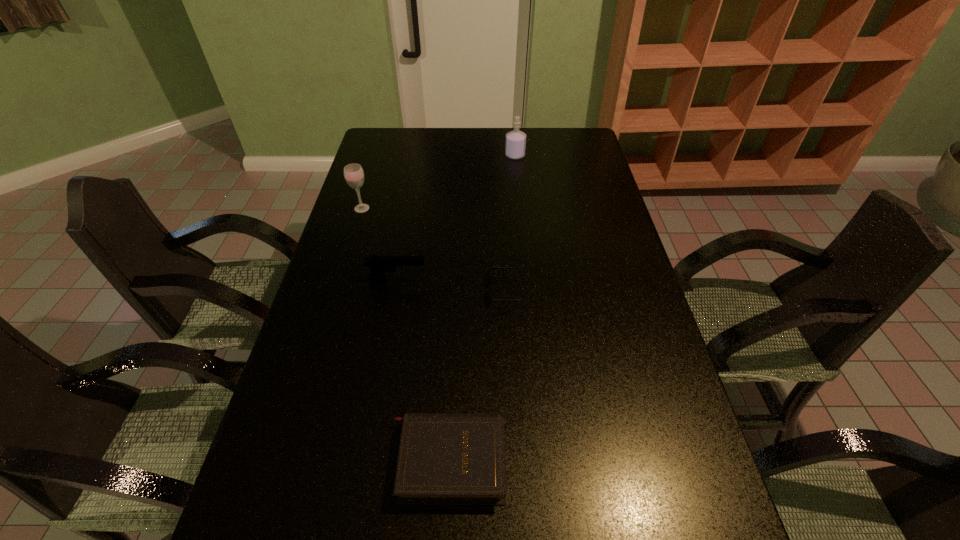
Find the location of a particular element. The height and width of the screenshot is (540, 960). free space located 0.120m on the front-facing side of the sunglasses is located at coordinates (448, 290).

Locate an element on the screen. This screenshot has width=960, height=540. free region located 0.330m on the front-facing side of the sunglasses is located at coordinates (373, 290).

Locate an element on the screen. This screenshot has width=960, height=540. free spot located 0.150m on the front-facing side of the sunglasses is located at coordinates (438, 290).

Find the location of a particular element. The width and height of the screenshot is (960, 540). object at the far edge is located at coordinates (515, 145).

This screenshot has width=960, height=540. I want to click on wineglass located in the left edge section of the desktop, so click(x=353, y=173).

Find the location of `pistol situated at the left edge`. pistol situated at the left edge is located at coordinates (379, 264).

This screenshot has height=540, width=960. In the image, there is a desktop. Identify the location of blank space at the left edge. (373, 292).

The width and height of the screenshot is (960, 540). Identify the location of vacant space at the right edge of the desktop. (628, 305).

Locate an element on the screen. The image size is (960, 540). blank space at the far left corner is located at coordinates (379, 137).

Image resolution: width=960 pixels, height=540 pixels. Find the location of `vacant area that lies between the sunglasses and the perfume`. vacant area that lies between the sunglasses and the perfume is located at coordinates (512, 223).